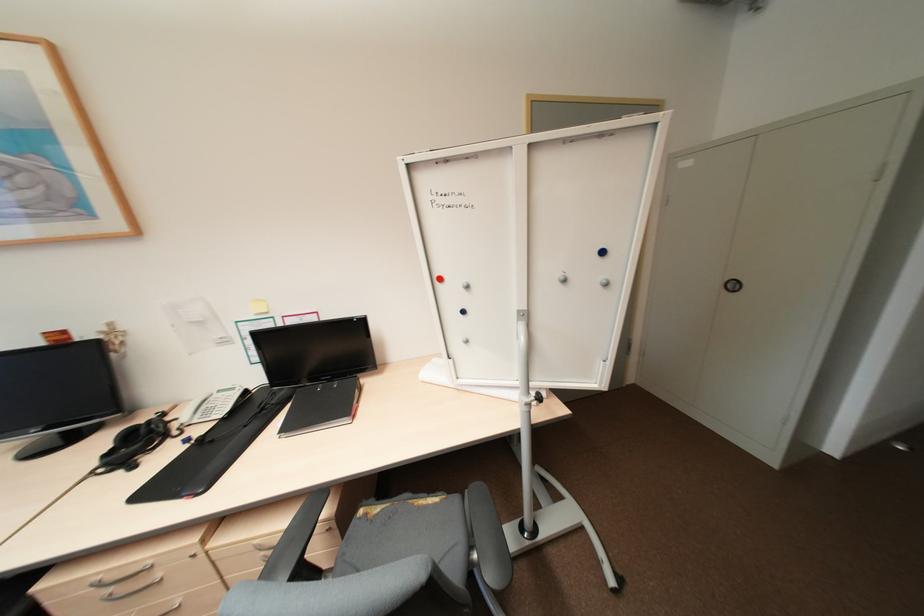
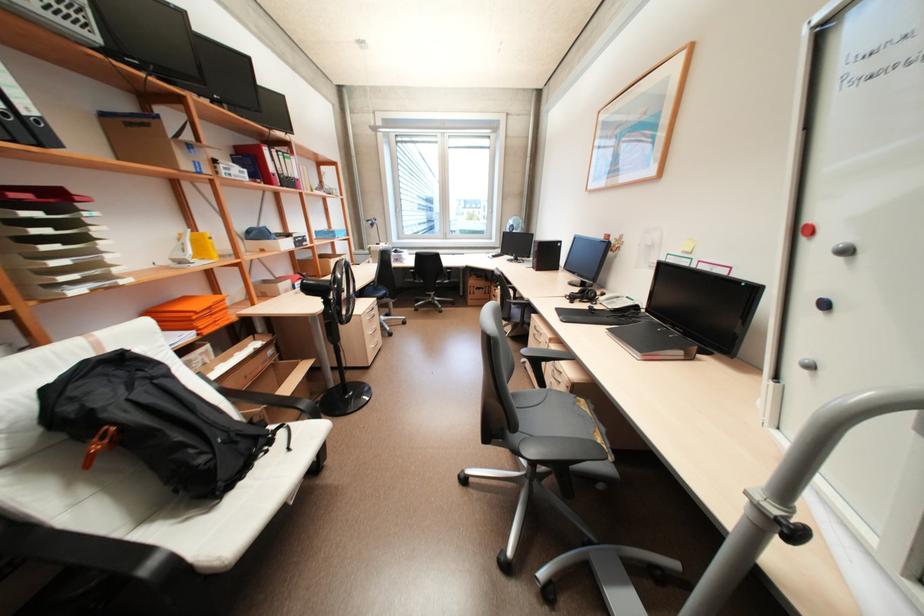
How did the camera likely rotate?

The camera's rotation is toward left-down.